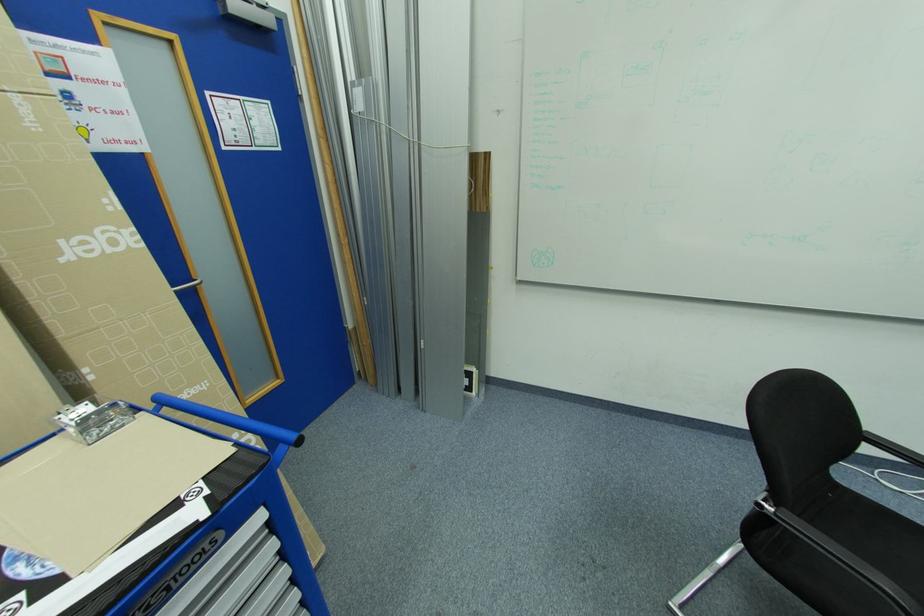
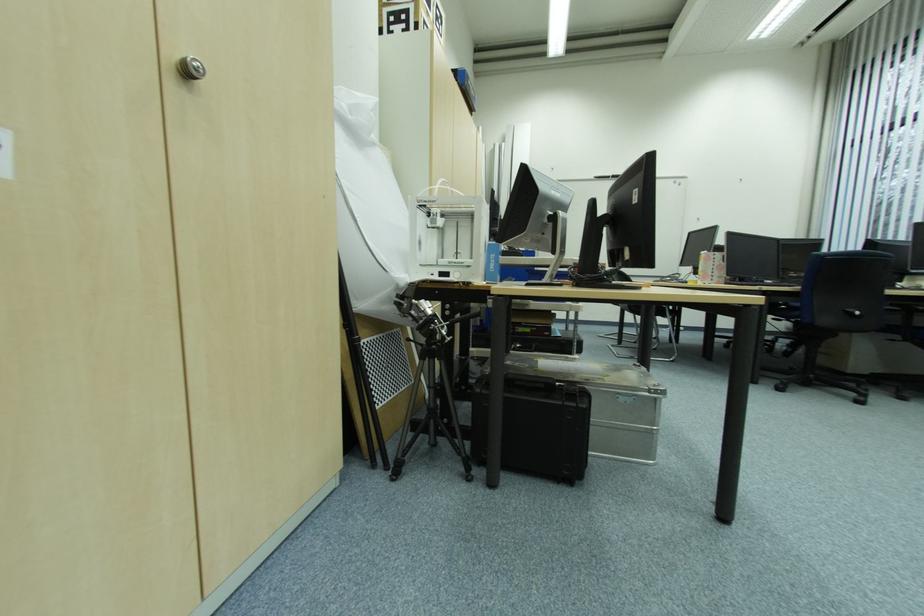
In a continuous first-person perspective shot, in which direction is the camera moving?

The cameraman walked toward left, backward.